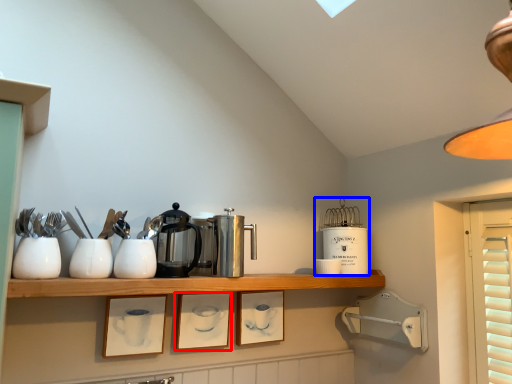
Question: Which point is closer to the camera, picture frame (highlighted by a red box) or appliance (highlighted by a blue box)?

Choices:
 (A) picture frame
 (B) appliance

Answer: (A)